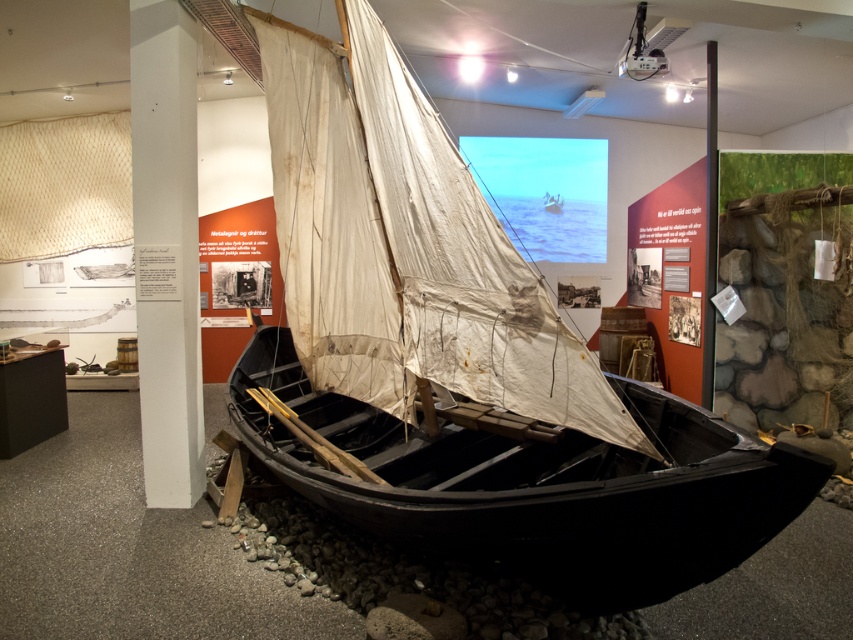
You are a museum curator planning to move the white canvas sail at center and the black polished wood canoe at center to a new exhibit. The new exhibit has a height restriction of 2 meters. Can both objects be moved without modification?

The white canvas sail at center is much taller than the black polished wood canoe at center. Since the sail is taller, if it exceeds 2 meters, it would need modification. However, without specific height measurements, we cannot confirm if it meets the restriction. Please measure the sail first.

You are an interior designer planning to move the white canvas sail at center and the black polished wood canoe at center to a new gallery space. The entrance of the new gallery has a doorway that is 2 meters wide. Can both objects pass through the doorway side by side without rotating them?

The white canvas sail at center is smaller than the black polished wood canoe at center. Since the doorway is 2 meters wide, but we don not have exact measurements of the objects, it is uncertain if they can pass through side by side without rotating them.